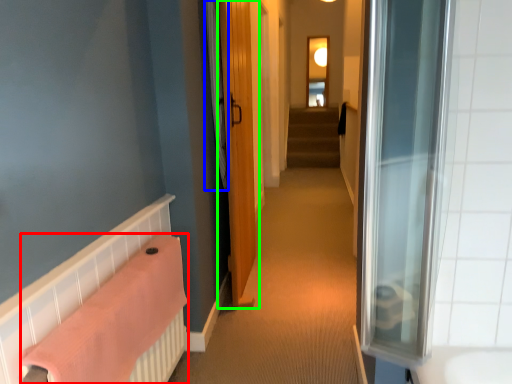
Question: Which is nearer to the bath towel (highlighted by a red box)? shower curtain (highlighted by a blue box) or door (highlighted by a green box).

Choices:
 (A) shower curtain
 (B) door

Answer: (A)